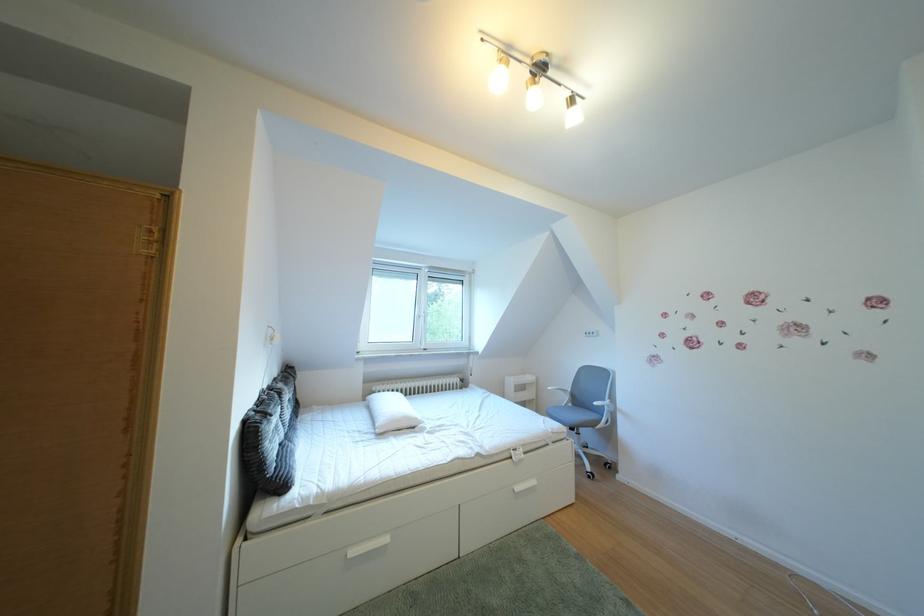
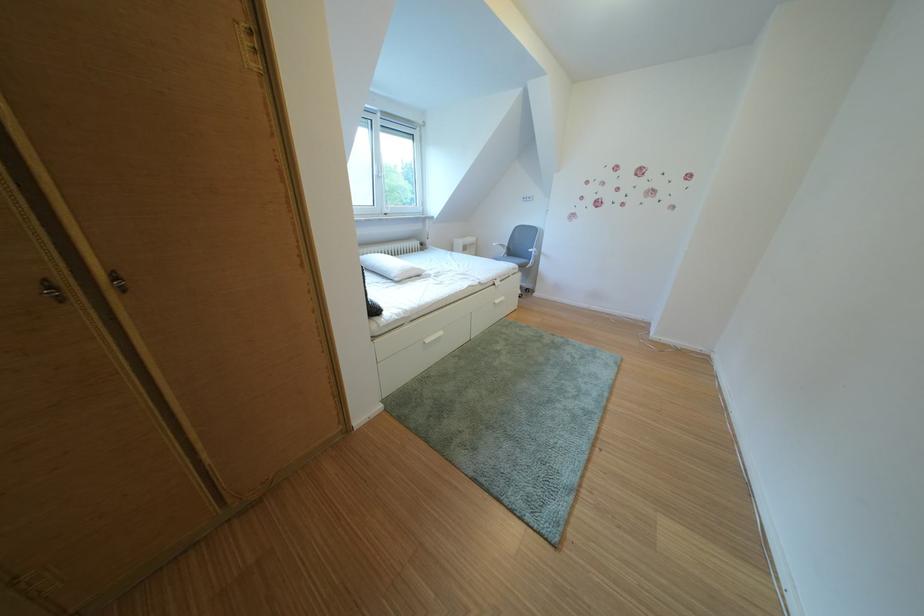
Where in the second image is the point corresponding to point (530, 493) from the first image?

(511, 307)